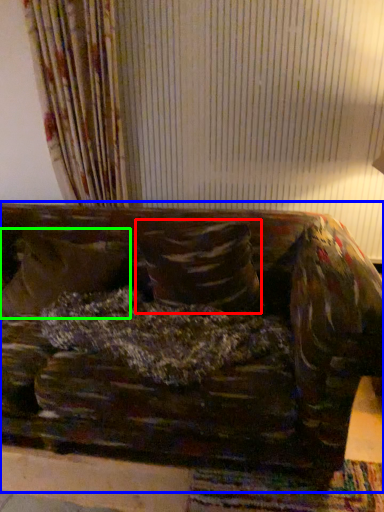
Question: Estimate the real-world distances between objects in this image. Which object is farther from pillow (highlighted by a red box), studio couch (highlighted by a blue box) or pillow (highlighted by a green box)?

Choices:
 (A) studio couch
 (B) pillow

Answer: (B)